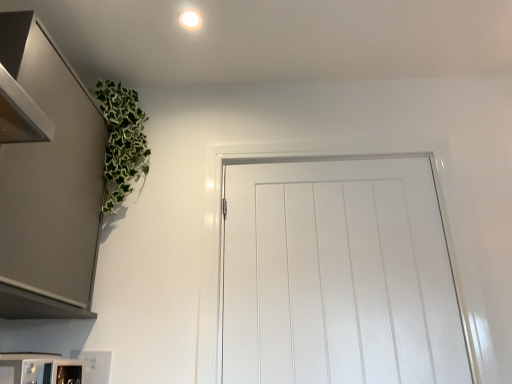
Question: Is the position of white glossy light fixture at upper center less distant than that of white glossy door at center?

Choices:
 (A) yes
 (B) no

Answer: (B)

Question: Does white glossy light fixture at upper center have a larger size compared to white glossy door at center?

Choices:
 (A) yes
 (B) no

Answer: (B)

Question: Can you confirm if white glossy light fixture at upper center is smaller than white glossy door at center?

Choices:
 (A) no
 (B) yes

Answer: (B)

Question: From the image's perspective, is white glossy light fixture at upper center over white glossy door at center?

Choices:
 (A) no
 (B) yes

Answer: (B)

Question: Is white glossy light fixture at upper center oriented towards white glossy door at center?

Choices:
 (A) no
 (B) yes

Answer: (A)

Question: From a real-world perspective, is satin metallic cabinet at upper left positioned above or below white glossy light fixture at upper center?

Choices:
 (A) below
 (B) above

Answer: (A)

Question: From the image's perspective, is satin metallic cabinet at upper left positioned above or below white glossy light fixture at upper center?

Choices:
 (A) below
 (B) above

Answer: (A)

Question: Relative to white glossy light fixture at upper center, is satin metallic cabinet at upper left in front or behind?

Choices:
 (A) front
 (B) behind

Answer: (A)

Question: Considering the positions of satin metallic cabinet at upper left and white glossy light fixture at upper center in the image, is satin metallic cabinet at upper left bigger or smaller than white glossy light fixture at upper center?

Choices:
 (A) big
 (B) small

Answer: (A)

Question: Is point (95, 382) closer or farther from the camera than point (189, 11)?

Choices:
 (A) closer
 (B) farther

Answer: (A)

Question: From their relative heights in the image, would you say white glossy microwave at lower left is taller or shorter than white glossy light fixture at upper center?

Choices:
 (A) short
 (B) tall

Answer: (B)

Question: Based on their positions, is white glossy microwave at lower left located to the left or right of white glossy light fixture at upper center?

Choices:
 (A) left
 (B) right

Answer: (A)

Question: Considering the positions of white glossy microwave at lower left and white glossy light fixture at upper center in the image, is white glossy microwave at lower left bigger or smaller than white glossy light fixture at upper center?

Choices:
 (A) small
 (B) big

Answer: (B)

Question: Considering the relative positions of satin metallic cabinet at upper left and white glossy door at center in the image provided, is satin metallic cabinet at upper left to the left or to the right of white glossy door at center?

Choices:
 (A) right
 (B) left

Answer: (B)

Question: Considering the positions of satin metallic cabinet at upper left and white glossy door at center in the image, is satin metallic cabinet at upper left bigger or smaller than white glossy door at center?

Choices:
 (A) small
 (B) big

Answer: (B)